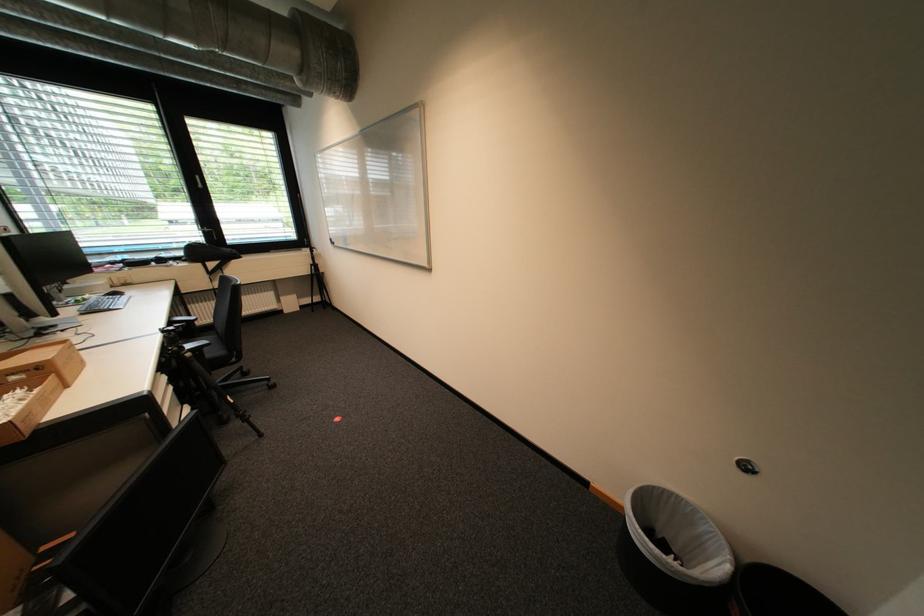
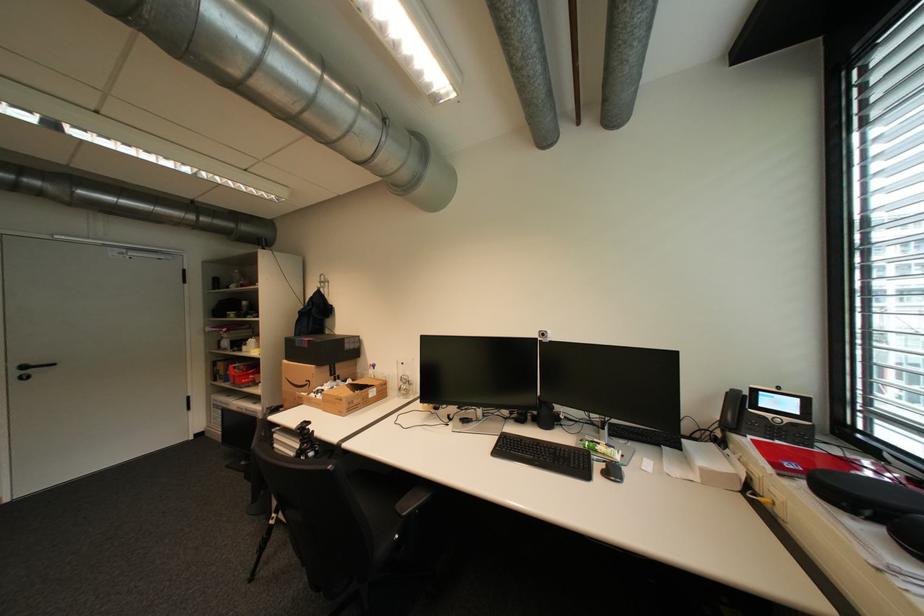
Question: I am providing you with two images of the same scene from different viewpoints. Which of the following objects are not visible in image2?

Choices:
 (A) black chair armrest
 (B) black box
 (C) red box
 (D) silver pitcher handle

Answer: (A)